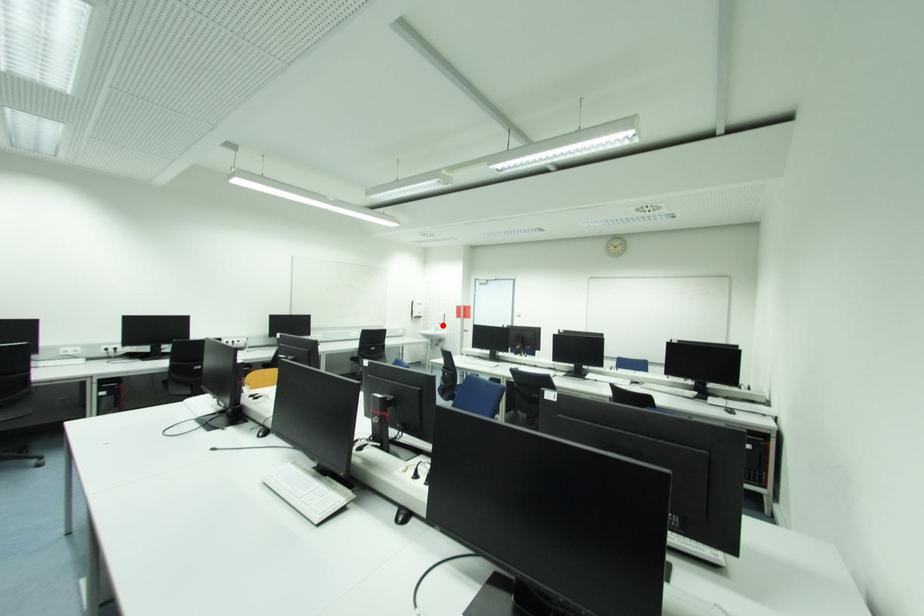
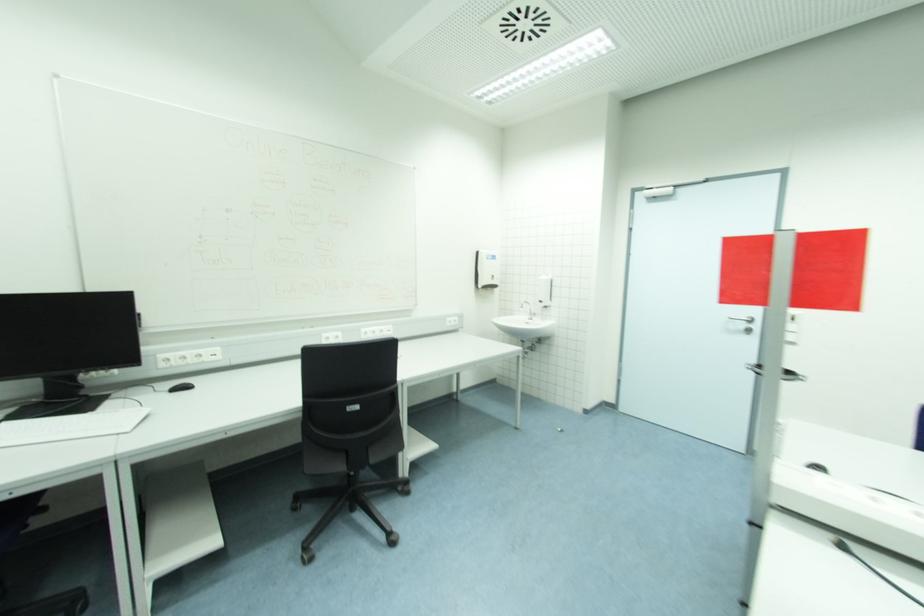
Find the pixel in the second image that matches the highlighted location in the first image.

(543, 302)